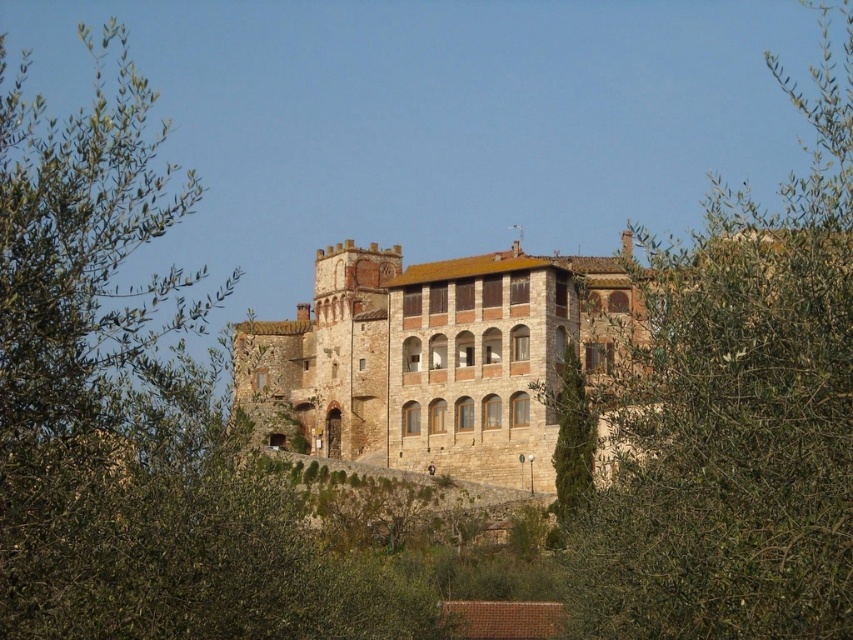
Can you confirm if green leafy tree at upper left is taller than green leafy tree at center?

No.

Is green leafy tree at upper left further to the viewer compared to green leafy tree at center?

Yes, green leafy tree at upper left is further from the viewer.

Is point (157, 486) closer to camera compared to point (651, 476)?

That is True.

This screenshot has width=853, height=640. Identify the location of green leafy tree at upper left. (138, 416).

Based on the photo, who is more forward, (x=735, y=460) or (x=573, y=385)?

Point (x=735, y=460) is in front.

Between green leafy tree at center and green textured tree at lower right, which one appears on the right side from the viewer's perspective?

From the viewer's perspective, green leafy tree at center appears more on the right side.

Which is behind, point (795, 417) or point (558, 392)?

The point (558, 392) is behind.

The height and width of the screenshot is (640, 853). I want to click on green leafy tree at center, so click(x=733, y=412).

Which is in front, point (142, 93) or point (503, 465)?

Point (142, 93) is more forward.

Does point (71, 564) lie behind point (492, 344)?

No, (71, 564) is closer to viewer.

Between point (125, 417) and point (258, 356), which one is positioned in front?

Point (125, 417)

What are the coordinates of `green leafy tree at upper left` in the screenshot? It's located at (138, 416).